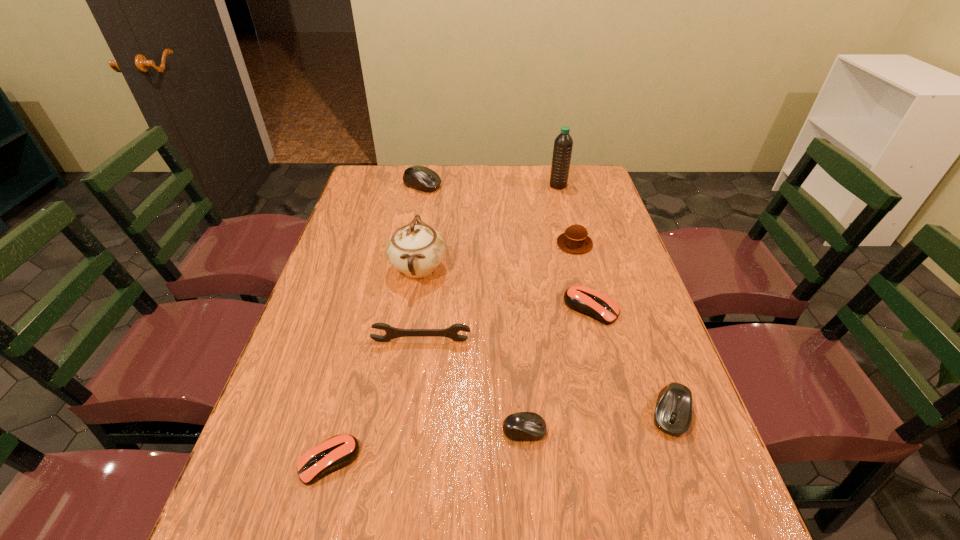
The height and width of the screenshot is (540, 960). I want to click on vacant space located 0.120m on the open ends of the wrench, so click(x=416, y=383).

The height and width of the screenshot is (540, 960). I want to click on vacant region located on the front of the second tallest computer mouse, so [691, 468].

This screenshot has height=540, width=960. Identify the location of free space located on the back of the farthest orange computer mouse. (573, 237).

Where is `free space located on the front of the fourth computer mouse from right to left`? This screenshot has height=540, width=960. free space located on the front of the fourth computer mouse from right to left is located at coordinates (527, 467).

Locate an element on the screen. The height and width of the screenshot is (540, 960). blank area located 0.230m on the back of the second biggest orange computer mouse is located at coordinates (358, 349).

I want to click on water bottle that is at the far edge, so click(563, 144).

Locate an element on the screen. mouse that is positioned at the far edge is located at coordinates (421, 178).

This screenshot has width=960, height=540. Identify the location of object that is at the left edge. click(x=335, y=453).

This screenshot has height=540, width=960. What are the coordinates of `water bottle that is at the right edge` in the screenshot? It's located at (563, 144).

The image size is (960, 540). I want to click on muffin at the right edge, so click(x=575, y=240).